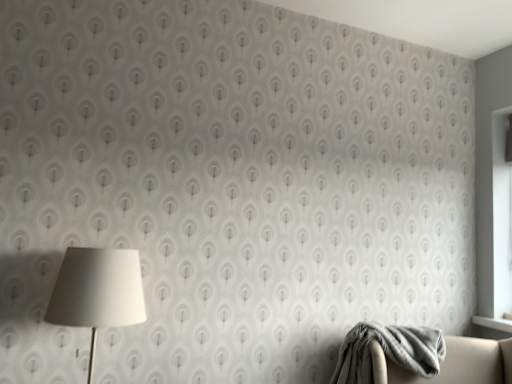
Question: Can you confirm if white matte lamp at left is taller than gray soft blanket at lower right?

Choices:
 (A) no
 (B) yes

Answer: (B)

Question: Is white matte lamp at left not close to gray soft blanket at lower right?

Choices:
 (A) yes
 (B) no

Answer: (A)

Question: From a real-world perspective, is white matte lamp at left below gray soft blanket at lower right?

Choices:
 (A) no
 (B) yes

Answer: (A)

Question: Is gray soft blanket at lower right at the back of white matte lamp at left?

Choices:
 (A) no
 (B) yes

Answer: (A)

Question: Is white matte lamp at left outside of gray soft blanket at lower right?

Choices:
 (A) no
 (B) yes

Answer: (B)

Question: Can you confirm if white matte lamp at left is shorter than gray soft blanket at lower right?

Choices:
 (A) no
 (B) yes

Answer: (A)

Question: Is gray soft blanket at lower right oriented towards white matte lamp at left?

Choices:
 (A) no
 (B) yes

Answer: (A)

Question: Is the position of gray soft blanket at lower right more distant than that of white matte lamp at left?

Choices:
 (A) yes
 (B) no

Answer: (A)

Question: From the image's perspective, would you say gray soft blanket at lower right is positioned over white matte lamp at left?

Choices:
 (A) no
 (B) yes

Answer: (A)

Question: Is there a large distance between gray soft blanket at lower right and white matte lamp at left?

Choices:
 (A) no
 (B) yes

Answer: (B)

Question: From a real-world perspective, is gray soft blanket at lower right under white matte lamp at left?

Choices:
 (A) yes
 (B) no

Answer: (A)

Question: Is gray soft blanket at lower right wider than white matte lamp at left?

Choices:
 (A) no
 (B) yes

Answer: (B)

Question: Is point (357, 365) closer or farther from the camera than point (67, 316)?

Choices:
 (A) farther
 (B) closer

Answer: (A)